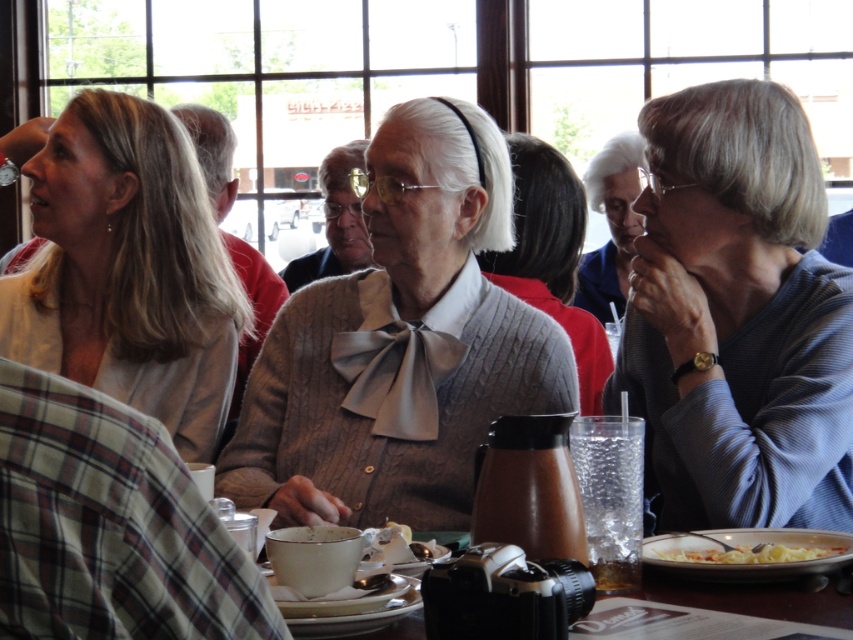
You are sitting at the table in the image and want to reach for an item located at point A and another at point B. If point A corresponds to point (51, 138) and point B to (651, 545), which point is closer to you?

Point B at (651, 545) is closer to you because point A at (51, 138) is behind it.

You are a photographer standing at the table in the scene. You want to take a closeup shot of the knitted gray sweater at center without moving any objects. Can you reach the sweater from your current position?

The knitted gray sweater at center is 2.28 meters away from viewer, so you cannot reach it from your current position without moving closer or using an extendable tool.

From the picture: You are a photographer who needs to place a small tripod between the matte beige sweater at left and the white matte pasta bowl at lower right. Considering their heights, which object should the tripod be placed closer to?

The matte beige sweater at left is much taller than the white matte pasta bowl at lower right, so the tripod should be placed closer to the white matte pasta bowl at lower right to avoid blocking the view of the taller sweater.